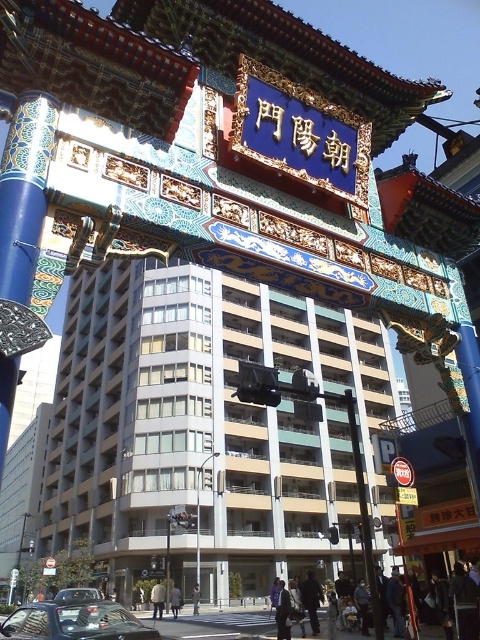
Does black glossy car at lower left come in front of matte black car at lower left?

Yes.

Does point (26, 609) come behind point (83, 592)?

No, it is in front of (83, 592).

Find the location of a particular element. black glossy car at lower left is located at coordinates (74, 621).